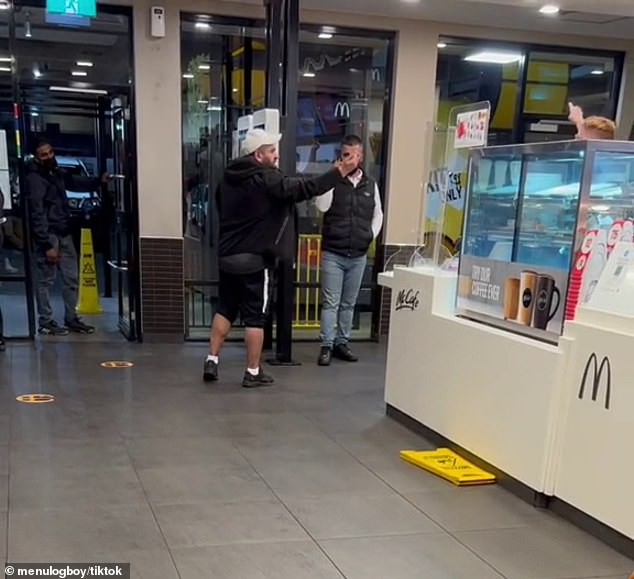
Locate an element on the screen. The image size is (634, 579). tile floor is located at coordinates pyautogui.click(x=94, y=444), pyautogui.click(x=231, y=445), pyautogui.click(x=382, y=532), pyautogui.click(x=307, y=535).